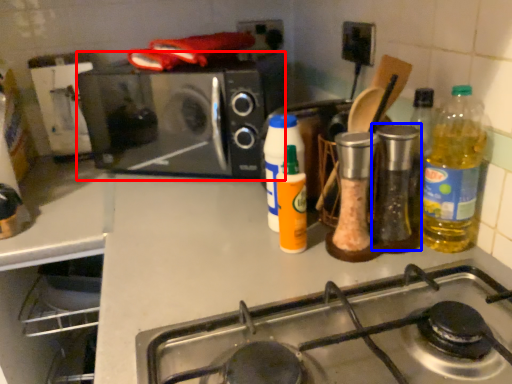
Question: Which point is further to the camera, microwave oven (highlighted by a red box) or bottle (highlighted by a blue box)?

Choices:
 (A) microwave oven
 (B) bottle

Answer: (A)